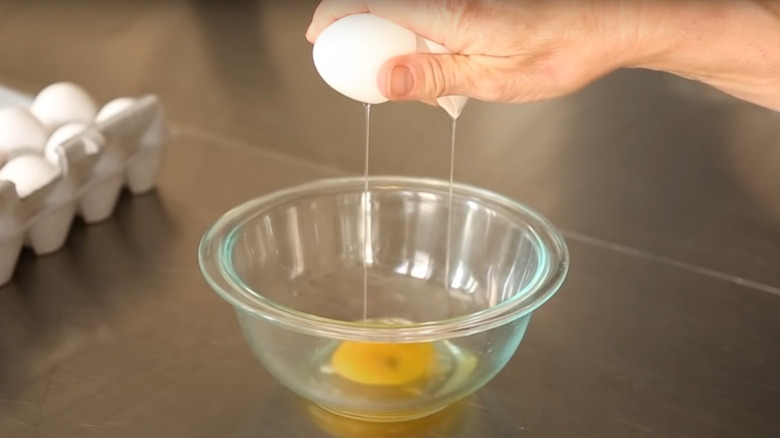
Where is `rim of bowl`? The image size is (780, 438). rim of bowl is located at coordinates (539, 301).